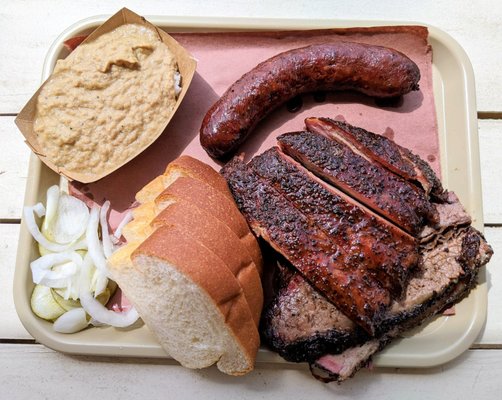
You are a GUI agent. You are given a task and a screenshot of the screen. Output one action in this format:
    pyautogui.click(x=<x>, y=<y>)
    Task: Click on the sheet
    This screenshot has width=502, height=400.
    Given the screenshot: What is the action you would take?
    pyautogui.click(x=414, y=53)